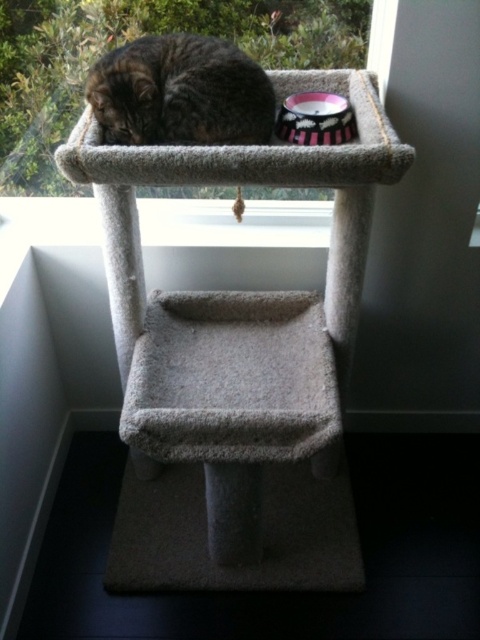
Question: Which point is farther from the camera taking this photo?

Choices:
 (A) (350, 8)
 (B) (253, 140)

Answer: (A)

Question: Can you confirm if clear glass window at upper center is positioned below tabby fur cat at upper center?

Choices:
 (A) no
 (B) yes

Answer: (A)

Question: Which point is closer to the camera taking this photo?

Choices:
 (A) (37, 54)
 (B) (131, 125)

Answer: (B)

Question: Can you confirm if clear glass window at upper center is bigger than tabby fur cat at upper center?

Choices:
 (A) no
 (B) yes

Answer: (B)

Question: Does clear glass window at upper center appear on the left side of tabby fur cat at upper center?

Choices:
 (A) yes
 (B) no

Answer: (A)

Question: Which object is closer to the camera taking this photo?

Choices:
 (A) tabby fur cat at upper center
 (B) clear glass window at upper center

Answer: (A)